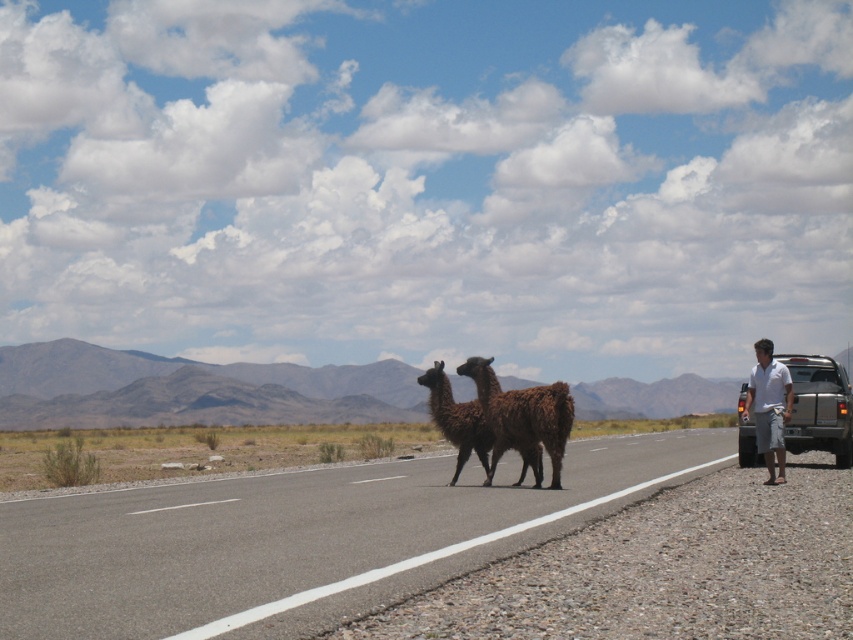
Question: Is asphalt road at center behind brown woolly alpaca at center?

Choices:
 (A) no
 (B) yes

Answer: (A)

Question: Does brown woolly alpaca at center have a smaller size compared to white cotton shirt at right?

Choices:
 (A) yes
 (B) no

Answer: (A)

Question: Estimate the real-world distances between objects in this image. Which object is closer to the white cotton shirt at right?

Choices:
 (A) asphalt road at center
 (B) brown woolly alpaca at center
 (C) silver metallic truck at right

Answer: (C)

Question: Which point is closer to the camera taking this photo?

Choices:
 (A) [x=560, y=390]
 (B) [x=779, y=358]
 (C) [x=390, y=547]

Answer: (C)

Question: Based on their relative distances, which object is farther from the brown woolly alpaca at center?

Choices:
 (A) asphalt road at center
 (B) silver metallic truck at right

Answer: (B)

Question: Observing the image, what is the correct spatial positioning of asphalt road at center in reference to white cotton shirt at right?

Choices:
 (A) right
 (B) left

Answer: (B)